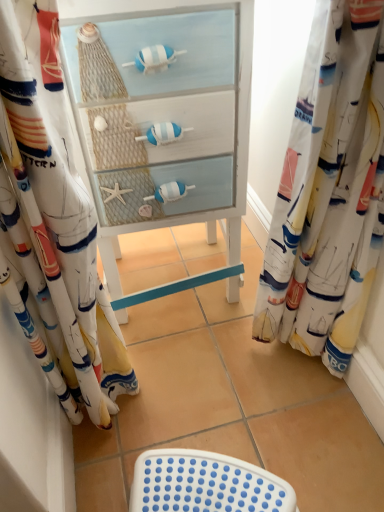
Image resolution: width=384 pixels, height=512 pixels. What do you see at coordinates (60, 185) in the screenshot? I see `white sailboat-patterned fabric at left, which appears as the first curtain when viewed from the left` at bounding box center [60, 185].

Describe the element at coordinates (324, 176) in the screenshot. The height and width of the screenshot is (512, 384). I see `white sailboat-patterned fabric at right, which is the second curtain from left to right` at that location.

Identify the location of white plastic stool at lower center. The width and height of the screenshot is (384, 512). (219, 441).

Identify the location of white sailboat-patterned fabric at left, which appears as the first curtain when viewed from the left. (60, 185).

Which is further, [84,123] or [236,433]?

Positioned behind is point [236,433].

In the scene shown: From the image's perspective, is white painted wood cabinet at center beneath white plastic stool at lower center?

No, from the image's perspective, white painted wood cabinet at center is not beneath white plastic stool at lower center.

From the picture: Considering the sizes of objects white painted wood cabinet at center and white plastic stool at lower center in the image provided, who is thinner, white painted wood cabinet at center or white plastic stool at lower center?

white plastic stool at lower center is thinner.

Is white plastic stool at lower center in front of or behind white painted wood cabinet at center in the image?

white plastic stool at lower center is positioned farther from the viewer than white painted wood cabinet at center.

From a real-world perspective, who is located lower, white plastic stool at lower center or white painted wood cabinet at center?

In real-world perspective, white plastic stool at lower center is lower.

Which is closer, (235,433) or (172,168)?

The point (172,168) is in front.

Is white plastic stool at lower center looking in the opposite direction of white painted wood cabinet at center?

Yes, white plastic stool at lower center's orientation is away from white painted wood cabinet at center.

Which of these two, white sailboat-patterned fabric at left, which appears as the first curtain when viewed from the left, or white painted wood cabinet at center, is wider?

With larger width is white painted wood cabinet at center.

Could you measure the distance between white sailboat-patterned fabric at left, the 2th curtain when ordered from right to left, and white painted wood cabinet at center?

A distance of 10.43 inches exists between white sailboat-patterned fabric at left, the 2th curtain when ordered from right to left, and white painted wood cabinet at center.

Is white sailboat-patterned fabric at left, the 2th curtain when ordered from right to left, positioned with its back to white painted wood cabinet at center?

No, white sailboat-patterned fabric at left, the 2th curtain when ordered from right to left,'s orientation is not away from white painted wood cabinet at center.

Does point (98, 322) appear closer or farther from the camera than point (129, 145)?

Point (98, 322) is closer to the camera than point (129, 145).

Is white painted wood cabinet at center looking in the opposite direction of white sailboat-patterned fabric at left, the 2th curtain when ordered from right to left?

No, white sailboat-patterned fabric at left, the 2th curtain when ordered from right to left, is not at the back of white painted wood cabinet at center.

Is there a large distance between white painted wood cabinet at center and white sailboat-patterned fabric at left, the 2th curtain when ordered from right to left?

They are positioned close to each other.

From a real-world perspective, between white painted wood cabinet at center and white sailboat-patterned fabric at left, the 2th curtain when ordered from right to left, who is vertically lower?

white painted wood cabinet at center is physically lower.

Looking at this image, can you confirm if white painted wood cabinet at center is thinner than white sailboat-patterned fabric at left, the 2th curtain when ordered from right to left?

Incorrect, the width of white painted wood cabinet at center is not less than that of white sailboat-patterned fabric at left, the 2th curtain when ordered from right to left.

Can you confirm if white sailboat-patterned fabric at left, the 2th curtain when ordered from right to left, is bigger than white plastic stool at lower center?

Yes, white sailboat-patterned fabric at left, the 2th curtain when ordered from right to left, is bigger than white plastic stool at lower center.

From the picture: Are white sailboat-patterned fabric at left, which appears as the first curtain when viewed from the left, and white plastic stool at lower center located far from each other?

That's not correct — white sailboat-patterned fabric at left, which appears as the first curtain when viewed from the left, is a little close to white plastic stool at lower center.

From a real-world perspective, who is located higher, white sailboat-patterned fabric at right, which appears as the first curtain when viewed from the right, or white sailboat-patterned fabric at left, which appears as the first curtain when viewed from the left?

white sailboat-patterned fabric at left, which appears as the first curtain when viewed from the left, from a real-world perspective.

Is the position of white sailboat-patterned fabric at right, which is the second curtain from left to right, more distant than that of white sailboat-patterned fabric at left, which appears as the first curtain when viewed from the left?

Yes, it is.

In the scene shown: Is white sailboat-patterned fabric at right, which is the second curtain from left to right, turned away from white sailboat-patterned fabric at left, which appears as the first curtain when viewed from the left?

No, white sailboat-patterned fabric at right, which is the second curtain from left to right, is not facing the opposite direction of white sailboat-patterned fabric at left, which appears as the first curtain when viewed from the left.

Looking at their sizes, would you say white sailboat-patterned fabric at right, which appears as the first curtain when viewed from the right, is wider or thinner than white sailboat-patterned fabric at left, the 2th curtain when ordered from right to left?

white sailboat-patterned fabric at right, which appears as the first curtain when viewed from the right, is thinner than white sailboat-patterned fabric at left, the 2th curtain when ordered from right to left.

Between point (219, 433) and point (302, 180), which one is positioned in front?

The point (302, 180) is in front.

From the image's perspective, which is below, white plastic stool at lower center or white sailboat-patterned fabric at right, which is the second curtain from left to right?

white plastic stool at lower center, from the image's perspective.

From a real-world perspective, who is located higher, white plastic stool at lower center or white sailboat-patterned fabric at right, which is the second curtain from left to right?

In real-world perspective, white sailboat-patterned fabric at right, which is the second curtain from left to right, is above.

Considering the relative sizes of white plastic stool at lower center and white sailboat-patterned fabric at right, which is the second curtain from left to right, in the image provided, is white plastic stool at lower center bigger than white sailboat-patterned fabric at right, which is the second curtain from left to right,?

No, white plastic stool at lower center is not bigger than white sailboat-patterned fabric at right, which is the second curtain from left to right.

Locate an element on the screen. furniture above the white plastic stool at lower center (from the image's perspective) is located at coordinates (164, 121).

At what (x,y) coordinates should I click in order to perform the action: click on furniture in front of the white plastic stool at lower center. Please return your answer as a coordinate pair (x, y). This screenshot has width=384, height=512. Looking at the image, I should click on (164, 121).

Looking at the image, which one is located closer to white sailboat-patterned fabric at left, which appears as the first curtain when viewed from the left, white painted wood cabinet at center or white plastic stool at lower center?

Based on the image, white painted wood cabinet at center appears to be nearer to white sailboat-patterned fabric at left, which appears as the first curtain when viewed from the left.

From the image, which object appears to be nearer to white sailboat-patterned fabric at left, the 2th curtain when ordered from right to left, white sailboat-patterned fabric at right, which is the second curtain from left to right, or white painted wood cabinet at center?

Among the two, white painted wood cabinet at center is located nearer to white sailboat-patterned fabric at left, the 2th curtain when ordered from right to left.

Which object lies further to the anchor point white painted wood cabinet at center, white sailboat-patterned fabric at right, which is the second curtain from left to right, or white sailboat-patterned fabric at left, the 2th curtain when ordered from right to left?

white sailboat-patterned fabric at right, which is the second curtain from left to right, lies further to white painted wood cabinet at center than the other object.

Based on their spatial positions, is white painted wood cabinet at center or white sailboat-patterned fabric at left, the 2th curtain when ordered from right to left, further from white sailboat-patterned fabric at right, which appears as the first curtain when viewed from the right?

white sailboat-patterned fabric at left, the 2th curtain when ordered from right to left, is further to white sailboat-patterned fabric at right, which appears as the first curtain when viewed from the right.

Estimate the real-world distances between objects in this image. Which object is further from white plastic stool at lower center, white sailboat-patterned fabric at right, which is the second curtain from left to right, or white sailboat-patterned fabric at left, the 2th curtain when ordered from right to left?

white sailboat-patterned fabric at right, which is the second curtain from left to right, is positioned further to the anchor white plastic stool at lower center.

Which object lies nearer to the anchor point white plastic stool at lower center, white painted wood cabinet at center or white sailboat-patterned fabric at right, which is the second curtain from left to right?

Based on the image, white sailboat-patterned fabric at right, which is the second curtain from left to right, appears to be nearer to white plastic stool at lower center.

Considering their positions, is white sailboat-patterned fabric at left, the 2th curtain when ordered from right to left, positioned closer to white plastic stool at lower center than white painted wood cabinet at center?

white sailboat-patterned fabric at left, the 2th curtain when ordered from right to left.

Considering their positions, is white painted wood cabinet at center positioned further to white plastic stool at lower center than white sailboat-patterned fabric at left, which appears as the first curtain when viewed from the left?

white painted wood cabinet at center is further to white plastic stool at lower center.

Where is `curtain between white sailboat-patterned fabric at right, which appears as the first curtain when viewed from the right, and white plastic stool at lower center in the up-down direction`? The height and width of the screenshot is (512, 384). curtain between white sailboat-patterned fabric at right, which appears as the first curtain when viewed from the right, and white plastic stool at lower center in the up-down direction is located at coordinates (60, 185).

Identify the location of furniture located between white sailboat-patterned fabric at left, the 2th curtain when ordered from right to left, and white sailboat-patterned fabric at right, which appears as the first curtain when viewed from the right, in the left-right direction. (164, 121).